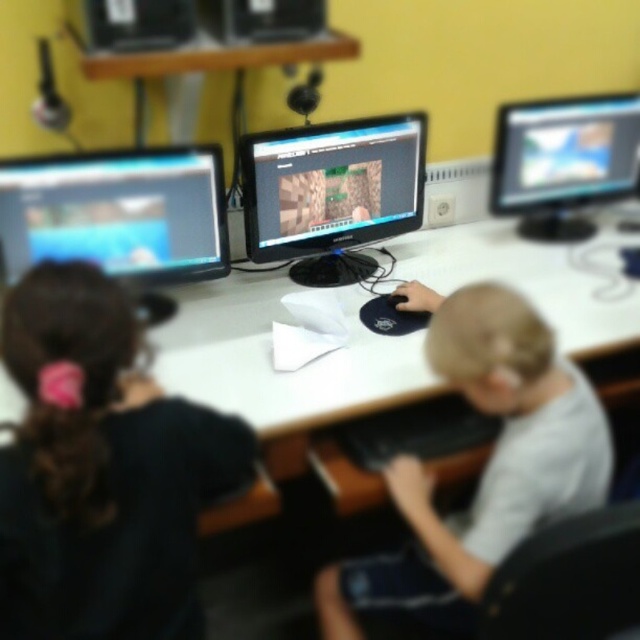
Question: Considering the relative positions of white glossy computer desk at center and matte black monitor at left in the image provided, where is white glossy computer desk at center located with respect to matte black monitor at left?

Choices:
 (A) left
 (B) right

Answer: (B)

Question: Can you confirm if light gray shirt at center is positioned above matte black monitor at left?

Choices:
 (A) yes
 (B) no

Answer: (B)

Question: Which point is closer to the camera taking this photo?

Choices:
 (A) (524, 324)
 (B) (104, 592)

Answer: (B)

Question: Which object is farther from the camera taking this photo?

Choices:
 (A) matte black monitor at center
 (B) white glossy computer desk at center
 (C) black matte shirt at left
 (D) light gray shirt at center

Answer: (A)

Question: Where is matte black monitor at left located in relation to matte black monitor at upper right in the image?

Choices:
 (A) left
 (B) right

Answer: (A)

Question: Which point is closer to the camera?

Choices:
 (A) (524, 116)
 (B) (403, 172)
 (C) (490, 464)
 (D) (113, 536)

Answer: (D)